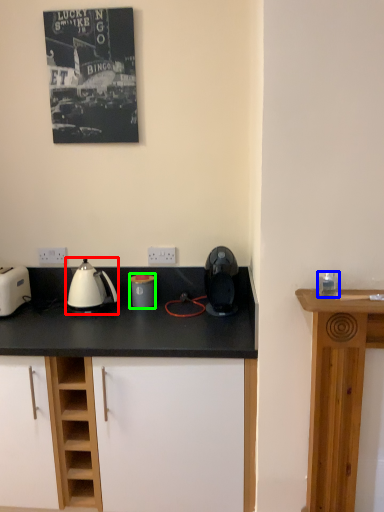
Question: Which object is the closest to the kettle (highlighted by a red box)? Choose among these: appliance (highlighted by a blue box) or kitchen appliance (highlighted by a green box).

Choices:
 (A) appliance
 (B) kitchen appliance

Answer: (B)